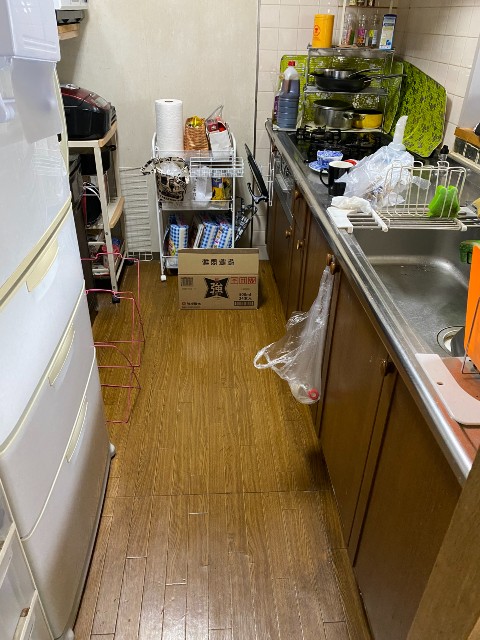
Where is `storage containers`? storage containers is located at coordinates (72, 516), (49, 442), (36, 348), (25, 220).